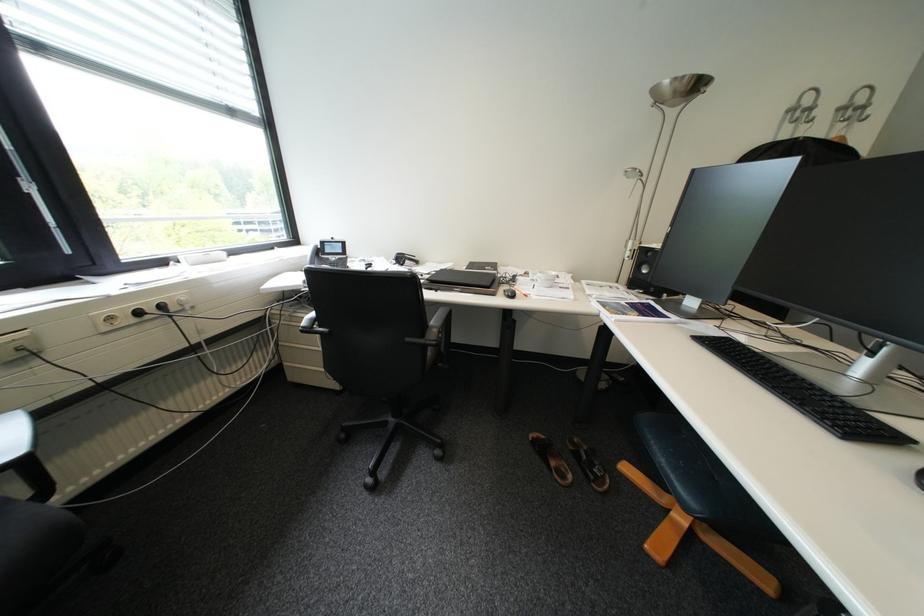
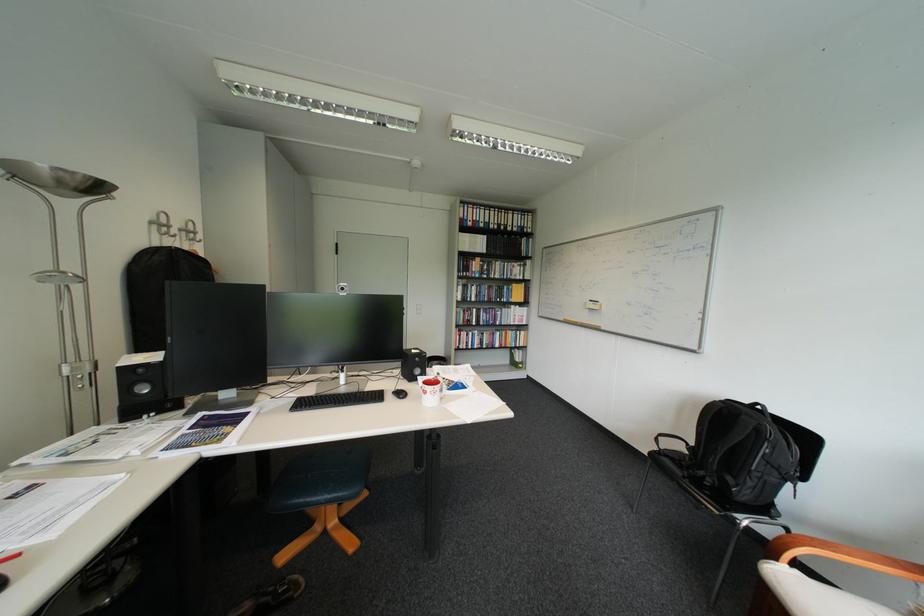
Where in the second image is the point corresponding to pixel 813 111 from the first image?

(173, 225)